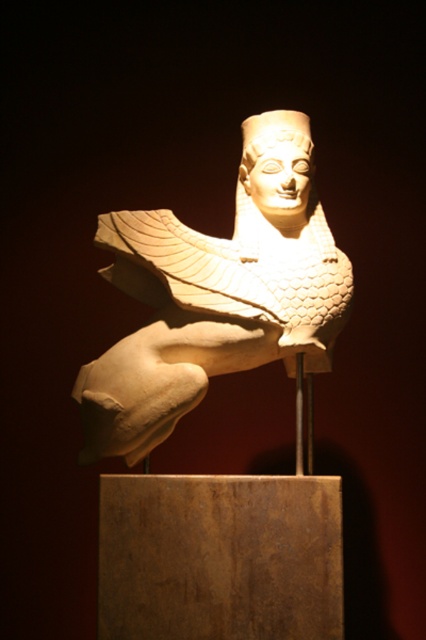
Question: Does white stone bird at center have a lesser width compared to white glossy head at center?

Choices:
 (A) no
 (B) yes

Answer: (A)

Question: Among these objects, which one is farthest from the camera?

Choices:
 (A) white glossy head at center
 (B) white stone bird at center

Answer: (A)

Question: Observing the image, what is the correct spatial positioning of white stone bird at center in reference to white glossy head at center?

Choices:
 (A) above
 (B) below

Answer: (B)

Question: Can you confirm if white stone bird at center is positioned above white glossy head at center?

Choices:
 (A) yes
 (B) no

Answer: (B)

Question: Which point is farther from the camera taking this photo?

Choices:
 (A) (296, 115)
 (B) (261, 244)

Answer: (A)